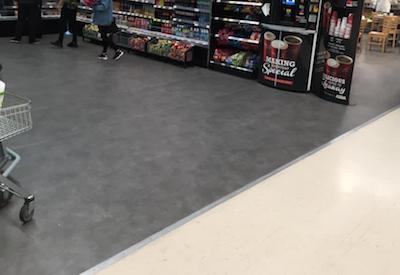
Where is `tile`? tile is located at coordinates (263, 218).